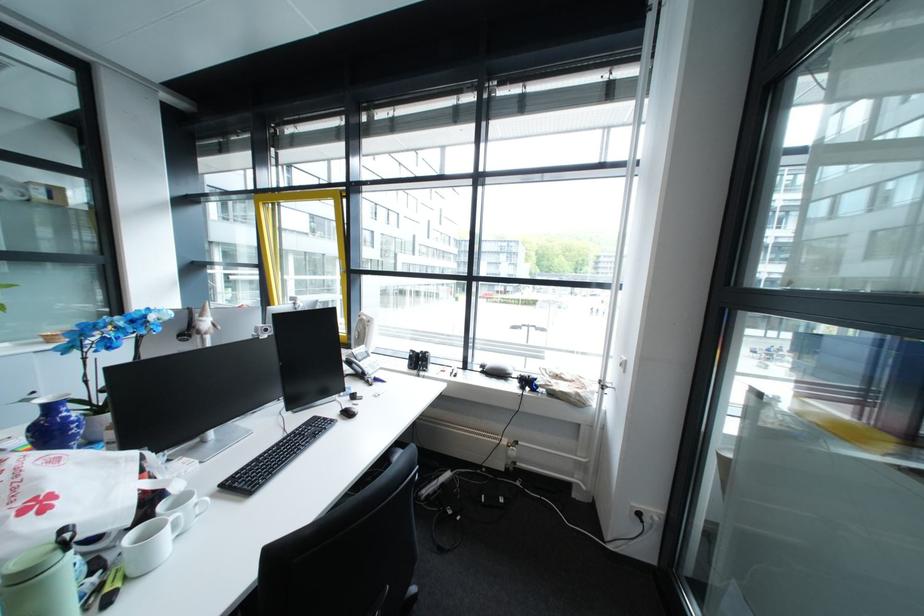
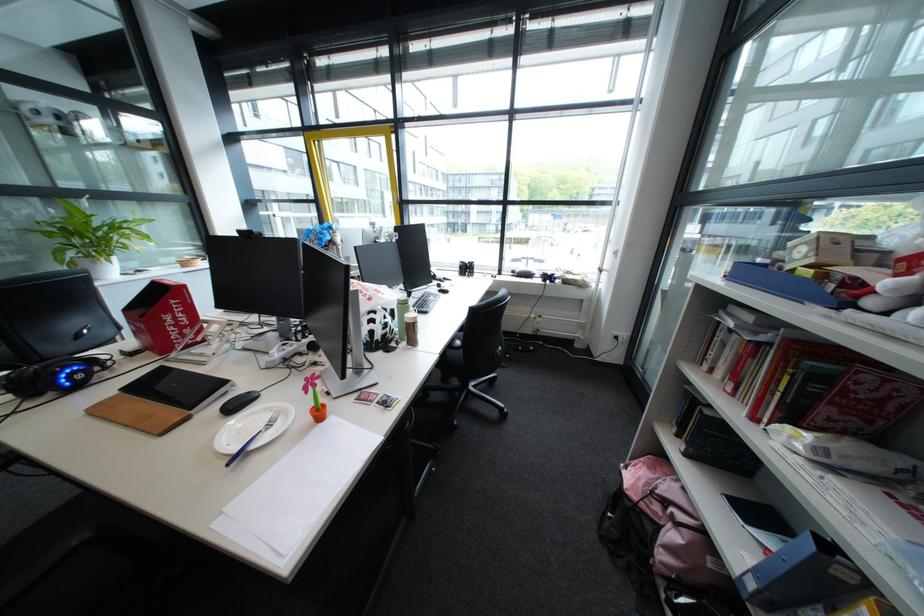
Question: How did the camera likely rotate?

Choices:
 (A) Left
 (B) Right
 (C) Up
 (D) Down

Answer: (D)